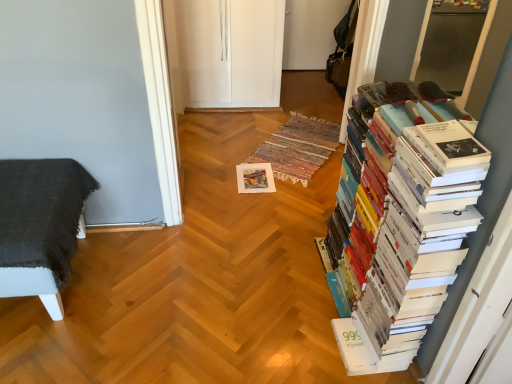
Where is `free spot to the right of dark gray woven blanket on the left`? The width and height of the screenshot is (512, 384). free spot to the right of dark gray woven blanket on the left is located at coordinates (150, 292).